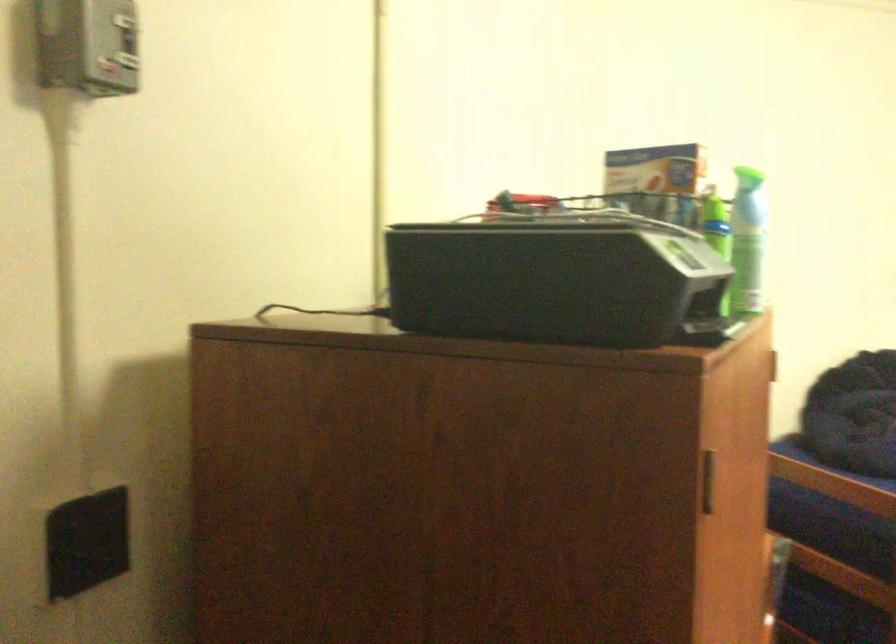
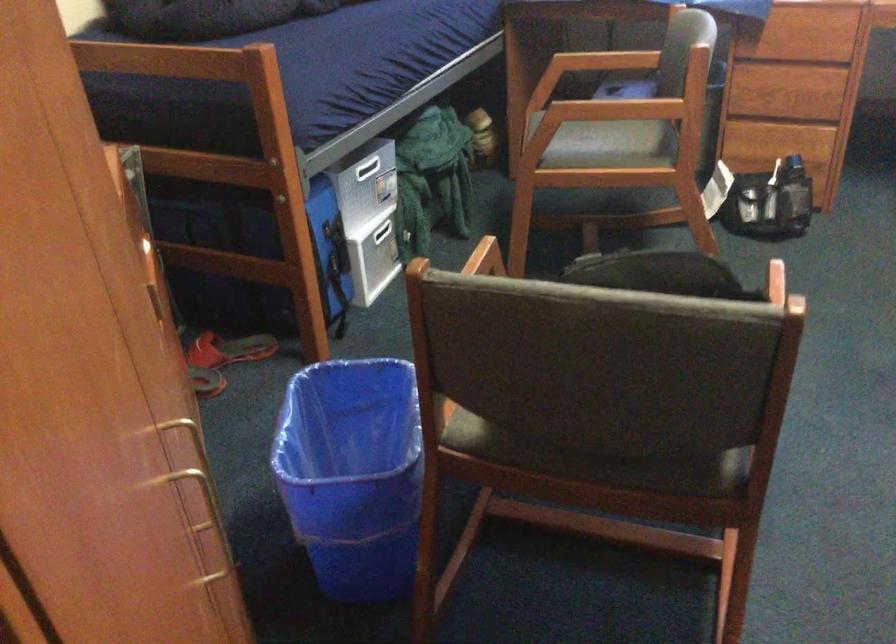
First-person continuous shooting, in which direction is the camera rotating?

The camera rotated toward right-down.